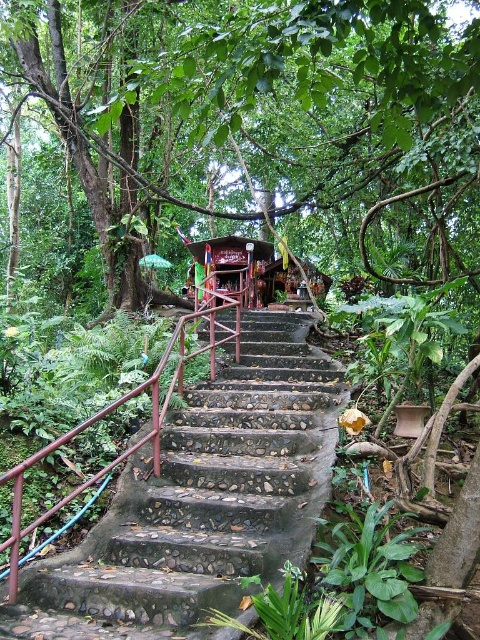
Question: Which object is closer to the camera taking this photo?

Choices:
 (A) green leafy tree at center
 (B) rustic stone stairs at center

Answer: (A)

Question: Which object is closer to the camera taking this photo?

Choices:
 (A) green leafy tree at center
 (B) rustic stone stairs at center

Answer: (A)

Question: Is green leafy tree at center wider than rustic stone stairs at center?

Choices:
 (A) no
 (B) yes

Answer: (B)

Question: Is green leafy tree at center to the right of rustic stone stairs at center from the viewer's perspective?

Choices:
 (A) no
 (B) yes

Answer: (A)

Question: Is green leafy tree at center bigger than rustic stone stairs at center?

Choices:
 (A) yes
 (B) no

Answer: (A)